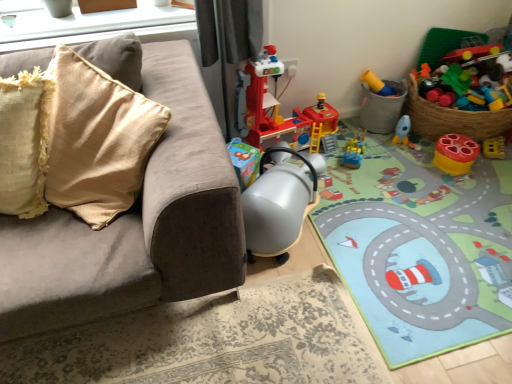
Find the location of a particular element. spots to the right of matte plastic toy at right, the 5th toy in the left-to-right sequence is located at coordinates coord(495,166).